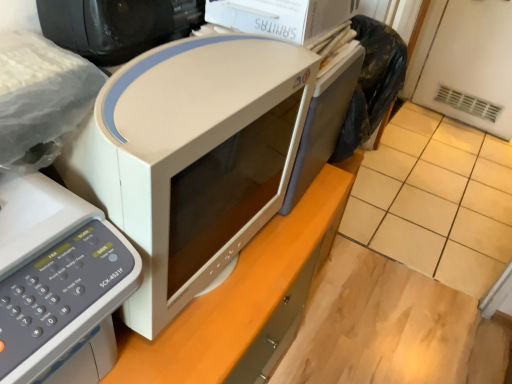
Question: Considering the relative sizes of black glossy desktop computer at upper left and white matte microwave at center, the first home appliance from the right, in the image provided, is black glossy desktop computer at upper left bigger than white matte microwave at center, the first home appliance from the right,?

Choices:
 (A) yes
 (B) no

Answer: (B)

Question: Can you confirm if black glossy desktop computer at upper left is taller than white matte microwave at center, which is counted as the second home appliance, starting from the left?

Choices:
 (A) no
 (B) yes

Answer: (A)

Question: Is black glossy desktop computer at upper left thinner than white matte microwave at center, the first home appliance from the right?

Choices:
 (A) no
 (B) yes

Answer: (B)

Question: Is white matte microwave at center, the first home appliance from the right, surrounded by black glossy desktop computer at upper left?

Choices:
 (A) yes
 (B) no

Answer: (B)

Question: From the image's perspective, would you say black glossy desktop computer at upper left is positioned over white matte microwave at center, which is counted as the second home appliance, starting from the left?

Choices:
 (A) yes
 (B) no

Answer: (A)

Question: Is black glossy desktop computer at upper left positioned beyond the bounds of white matte microwave at center, the first home appliance from the right?

Choices:
 (A) no
 (B) yes

Answer: (B)

Question: Is white matte microwave at center, which is counted as the second home appliance, starting from the left, oriented towards white matte computer desk at center?

Choices:
 (A) yes
 (B) no

Answer: (B)

Question: Is white matte microwave at center, the first home appliance from the right, positioned with its back to white matte computer desk at center?

Choices:
 (A) no
 (B) yes

Answer: (A)

Question: Is white matte microwave at center, the first home appliance from the right, smaller than white matte computer desk at center?

Choices:
 (A) yes
 (B) no

Answer: (A)

Question: Is white matte computer desk at center inside white matte microwave at center, the first home appliance from the right?

Choices:
 (A) yes
 (B) no

Answer: (B)

Question: From a real-world perspective, is white matte microwave at center, the first home appliance from the right, physically below white matte computer desk at center?

Choices:
 (A) yes
 (B) no

Answer: (B)

Question: Considering the relative sizes of white matte microwave at center, the first home appliance from the right, and white matte computer desk at center in the image provided, is white matte microwave at center, the first home appliance from the right, shorter than white matte computer desk at center?

Choices:
 (A) no
 (B) yes

Answer: (B)

Question: Can you confirm if white matte microwave at left, the first home appliance positioned from the left, is shorter than beige tile at center?

Choices:
 (A) no
 (B) yes

Answer: (A)